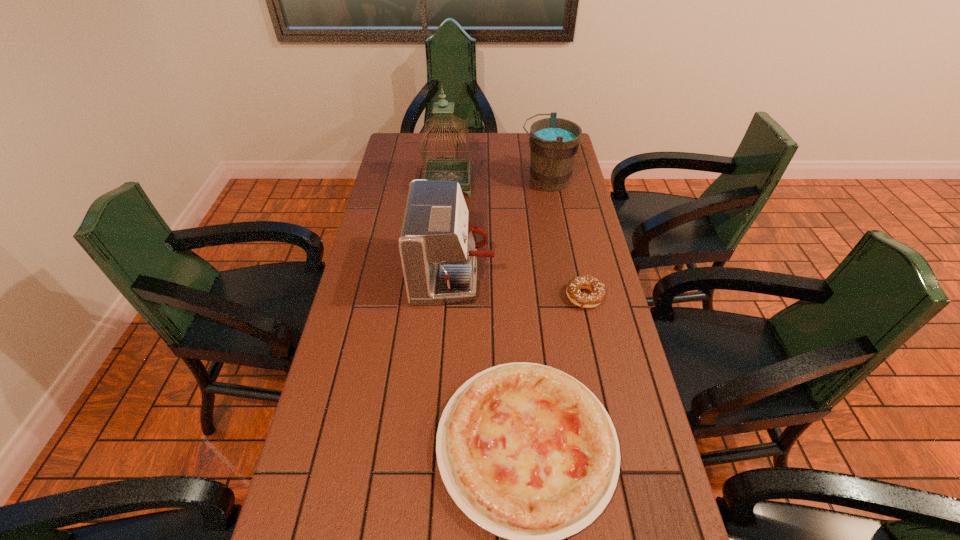
At what (x,y) coordinates should I click in order to perform the action: click on the tallest object. Please return your answer as a coordinate pair (x, y). This screenshot has width=960, height=540. Looking at the image, I should click on (459, 170).

Where is `coffee maker`? coffee maker is located at coordinates click(x=438, y=249).

Where is `wine bucket`? wine bucket is located at coordinates (554, 142).

Find the location of a particular element. doughnut is located at coordinates (597, 288).

Find the location of a particular element. This screenshot has width=960, height=540. free location located at the door of the tallest object is located at coordinates (441, 262).

The width and height of the screenshot is (960, 540). In order to click on vacant region located 0.070m on the front of the coffee maker near the spout in this screenshot , I will do `click(516, 275)`.

You are a GUI agent. You are given a task and a screenshot of the screen. Output one action in this format:
    pyautogui.click(x=<x>, y=<y>)
    Task: Click on the free space located 0.230m with a handle on the side of the wine bucket
    This screenshot has width=960, height=540.
    Given the screenshot: What is the action you would take?
    click(462, 181)

The width and height of the screenshot is (960, 540). I want to click on free space located with a handle on the side of the wine bucket, so click(x=468, y=181).

You are a GUI agent. You are given a task and a screenshot of the screen. Output one action in this format:
    pyautogui.click(x=<x>, y=<y>)
    Task: Click on the free location located with a handle on the side of the wine bucket
    This screenshot has height=540, width=960.
    Given the screenshot: What is the action you would take?
    pyautogui.click(x=426, y=181)

Image resolution: width=960 pixels, height=540 pixels. I want to click on vacant region located on the back of the doughnut, so click(x=574, y=251).